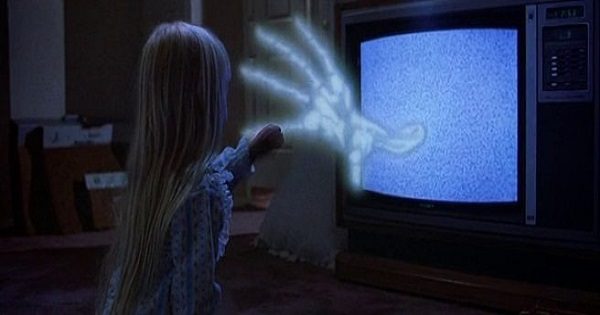
Identify the location of light blue light. This screenshot has width=600, height=315. (432, 100).